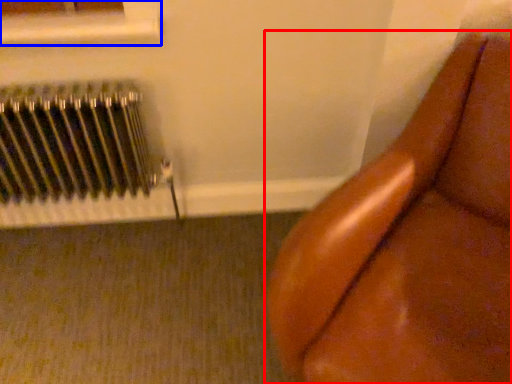
Question: Which of the following is the farthest to the observer, furniture (highlighted by a red box) or window frame (highlighted by a blue box)?

Choices:
 (A) furniture
 (B) window frame

Answer: (B)